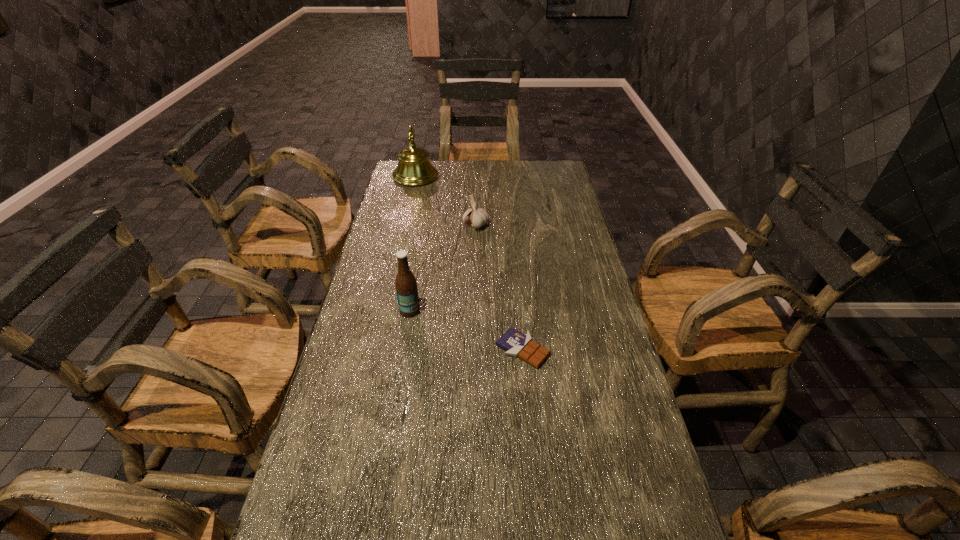
Find the location of a particular element. The image size is (960, 540). object located in the far edge section of the desktop is located at coordinates (414, 168).

Find the location of a particular element. bell that is at the left edge is located at coordinates (414, 168).

Where is `beer bottle at the left edge`? This screenshot has height=540, width=960. beer bottle at the left edge is located at coordinates (405, 283).

Locate an element on the screen. The height and width of the screenshot is (540, 960). object that is at the far left corner is located at coordinates (414, 168).

Image resolution: width=960 pixels, height=540 pixels. What are the coordinates of `free location at the far edge of the desktop` in the screenshot? It's located at (497, 180).

The image size is (960, 540). In the image, there is a desktop. Find the location of `vacant space at the left edge`. vacant space at the left edge is located at coordinates (318, 465).

Identify the location of vacant space at the right edge of the desktop. (576, 359).

The width and height of the screenshot is (960, 540). Identify the location of vacant space at the far right corner of the desktop. (556, 185).

Find the location of `empty space that is in between the third tallest object and the bell`. empty space that is in between the third tallest object and the bell is located at coordinates (445, 201).

Identify the location of blank region between the beer bottle and the rightmost object. This screenshot has height=540, width=960. (467, 330).